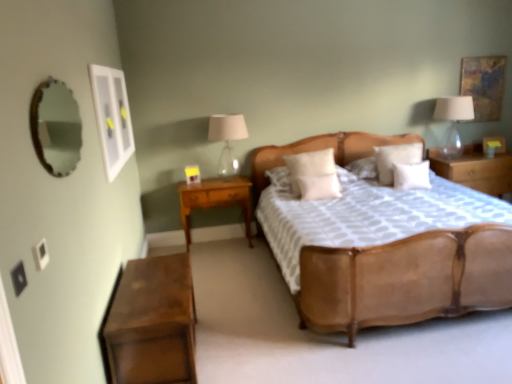
Question: Considering the relative sizes of white soft pillow at center, the fourth pillow in the right-to-left sequence, and wooden mirror at upper left in the image provided, is white soft pillow at center, the fourth pillow in the right-to-left sequence, smaller than wooden mirror at upper left?

Choices:
 (A) yes
 (B) no

Answer: (B)

Question: Is white soft pillow at center, the fourth pillow in the right-to-left sequence, not within wooden mirror at upper left?

Choices:
 (A) yes
 (B) no

Answer: (A)

Question: From a real-world perspective, is white soft pillow at center, the fourth pillow in the right-to-left sequence, beneath wooden mirror at upper left?

Choices:
 (A) no
 (B) yes

Answer: (B)

Question: Considering the relative positions of white soft pillow at center, which ranks as the 1th pillow in left-to-right order, and wooden mirror at upper left in the image provided, is white soft pillow at center, which ranks as the 1th pillow in left-to-right order, to the left of wooden mirror at upper left from the viewer's perspective?

Choices:
 (A) yes
 (B) no

Answer: (B)

Question: Would you say white soft pillow at center, the fourth pillow in the right-to-left sequence, contains wooden mirror at upper left?

Choices:
 (A) yes
 (B) no

Answer: (B)

Question: Can you confirm if white soft pillow at center, the fourth pillow in the right-to-left sequence, is positioned to the right of wooden mirror at upper left?

Choices:
 (A) yes
 (B) no

Answer: (A)

Question: Does white glossy picture frame at upper left, which is the 1th picture frame from bottom to top, have a greater width compared to white soft pillow at center, the third pillow viewed from the right?

Choices:
 (A) no
 (B) yes

Answer: (A)

Question: Is white glossy picture frame at upper left, placed as the first picture frame when sorted from left to right, closer to the viewer compared to white soft pillow at center, arranged as the 2th pillow when viewed from the left?

Choices:
 (A) no
 (B) yes

Answer: (B)

Question: Considering the relative sizes of white glossy picture frame at upper left, placed as the first picture frame when sorted from left to right, and white soft pillow at center, the third pillow viewed from the right, in the image provided, is white glossy picture frame at upper left, placed as the first picture frame when sorted from left to right, smaller than white soft pillow at center, the third pillow viewed from the right,?

Choices:
 (A) no
 (B) yes

Answer: (B)

Question: Does white glossy picture frame at upper left, marked as the 2th picture frame in a back-to-front arrangement, have a lesser width compared to white soft pillow at center, arranged as the 2th pillow when viewed from the left?

Choices:
 (A) no
 (B) yes

Answer: (B)

Question: From a real-world perspective, is white glossy picture frame at upper left, arranged as the 2th picture frame when viewed from the right, below white soft pillow at center, the third pillow viewed from the right?

Choices:
 (A) no
 (B) yes

Answer: (A)

Question: From the image's perspective, does white glossy picture frame at upper left, which is the 1th picture frame from bottom to top, appear lower than white soft pillow at center, the third pillow viewed from the right?

Choices:
 (A) yes
 (B) no

Answer: (B)

Question: Considering the relative positions of translucent glass lampshade at right, which is counted as the 1th bedside lamp, starting from the right, and white soft pillow at center, the third pillow viewed from the right, in the image provided, is translucent glass lampshade at right, which is counted as the 1th bedside lamp, starting from the right, to the left of white soft pillow at center, the third pillow viewed from the right, from the viewer's perspective?

Choices:
 (A) yes
 (B) no

Answer: (B)